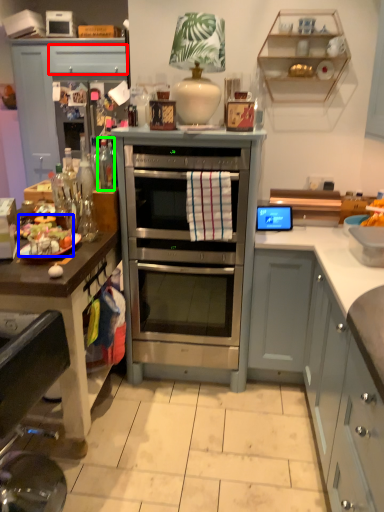
Question: Which object is positioned closest to drawer (highlighted by a red box)? Select from food (highlighted by a blue box) and bottle (highlighted by a green box).

Choices:
 (A) food
 (B) bottle

Answer: (B)